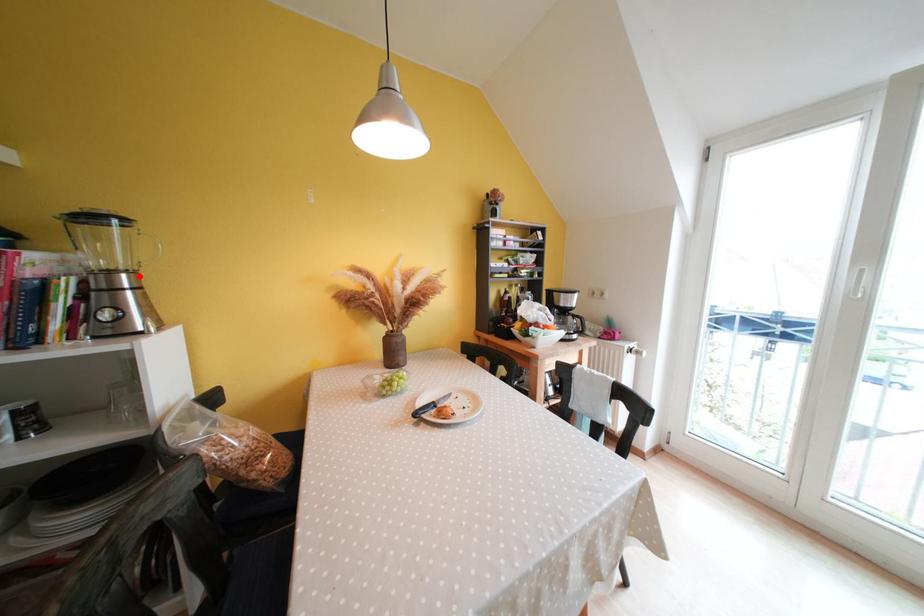
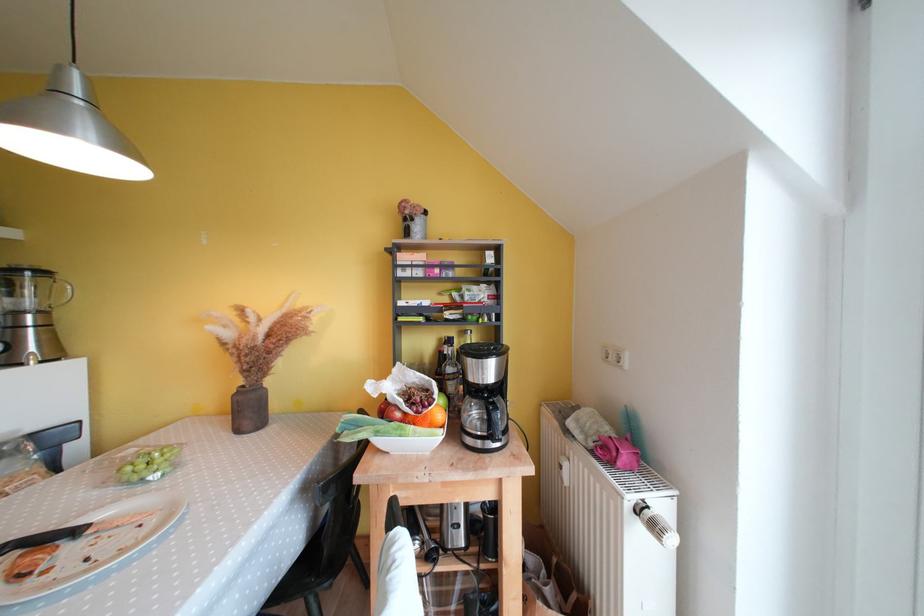
In the second image, find the point that corresponds to the highlighted location in the first image.

(49, 315)